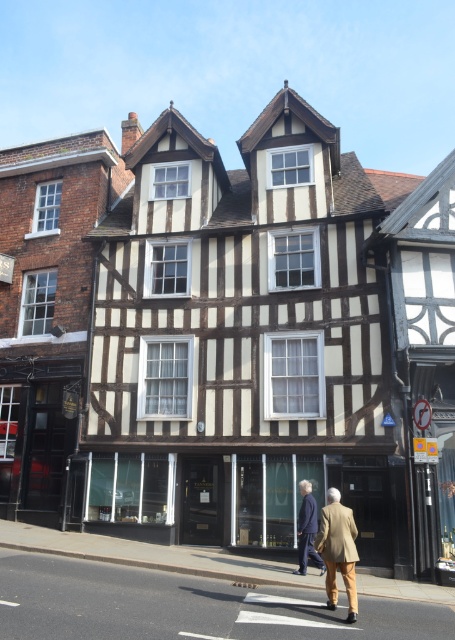
Question: Which object is closer to the camera taking this photo?

Choices:
 (A) light brown leather jacket at center
 (B) light brown leather jacket at lower center

Answer: (B)

Question: Does light brown leather jacket at lower center appear on the left side of light brown leather jacket at center?

Choices:
 (A) no
 (B) yes

Answer: (A)

Question: Is light brown leather jacket at lower center smaller than light brown leather jacket at center?

Choices:
 (A) no
 (B) yes

Answer: (A)

Question: Does light brown leather jacket at lower center appear under light brown leather jacket at center?

Choices:
 (A) yes
 (B) no

Answer: (B)